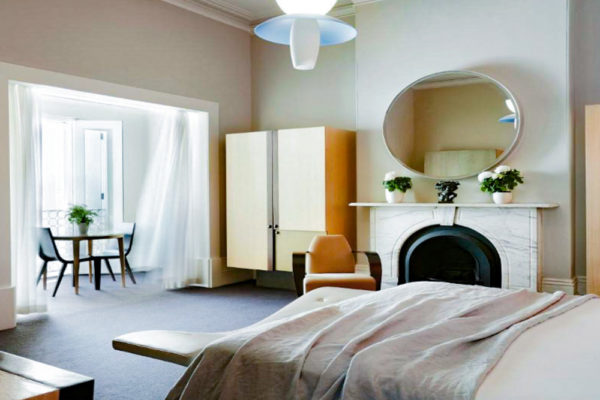
The width and height of the screenshot is (600, 400). What are the coordinates of `fireplace` in the screenshot? It's located at (465, 259).